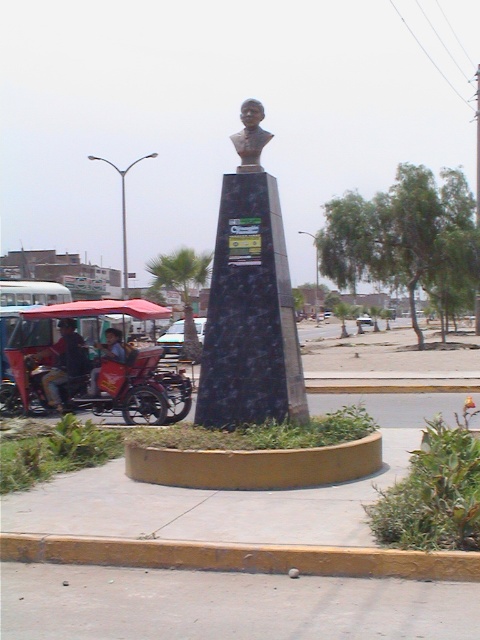
Question: Among these objects, which one is farthest from the camera?

Choices:
 (A) matte red cart at left
 (B) yellow concrete curb at lower center
 (C) bronze bust at center

Answer: (A)

Question: Is yellow concrete curb at lower center to the left of sandy brown bust at center from the viewer's perspective?

Choices:
 (A) no
 (B) yes

Answer: (A)

Question: Is sandy brown bust at center to the left of metallic red cart at left from the viewer's perspective?

Choices:
 (A) yes
 (B) no

Answer: (B)

Question: Which point appears farthest from the camera in this image?

Choices:
 (A) (50, 352)
 (B) (248, 150)
 (C) (386, 593)

Answer: (A)

Question: Which object is closer to the camera taking this photo?

Choices:
 (A) metallic red cart at left
 (B) bronze bust at center
 (C) yellow concrete curb at lower center
 (D) gray concrete pavement at lower center

Answer: (D)

Question: Does bronze bust at center have a lesser width compared to sandy brown bust at center?

Choices:
 (A) yes
 (B) no

Answer: (B)